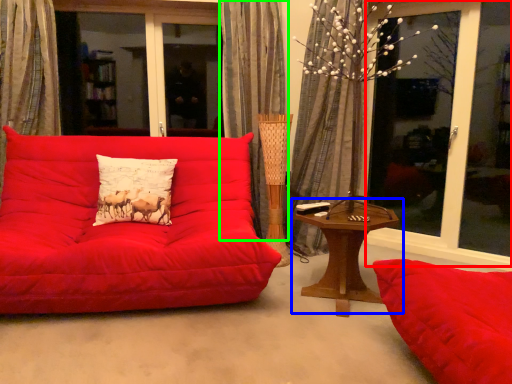
Question: Based on their relative distances, which object is farther from window screen (highlighted by a red box)? Choose from table (highlighted by a blue box) and curtain (highlighted by a green box).

Choices:
 (A) table
 (B) curtain

Answer: (B)